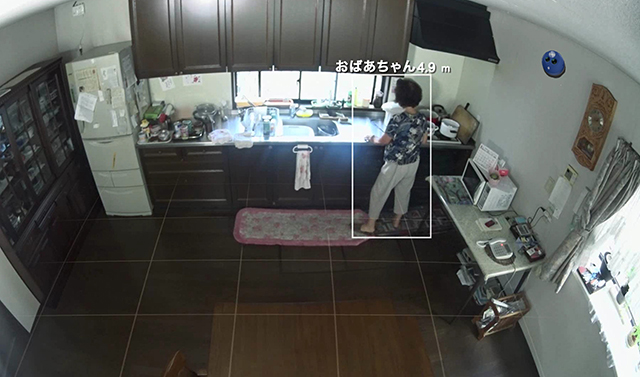
Find the location of a particular element. This screenshot has height=377, width=640. microwave is located at coordinates (468, 185).